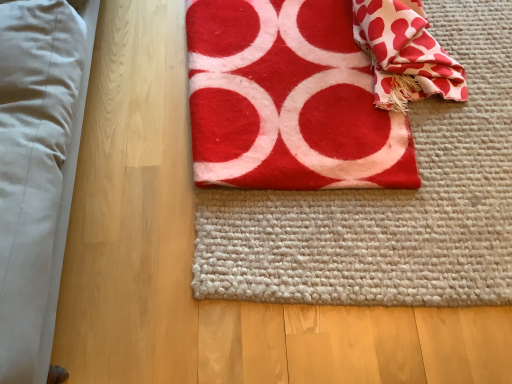
The height and width of the screenshot is (384, 512). What are the coordinates of `free space in front of red felt towel at center` in the screenshot? It's located at (336, 249).